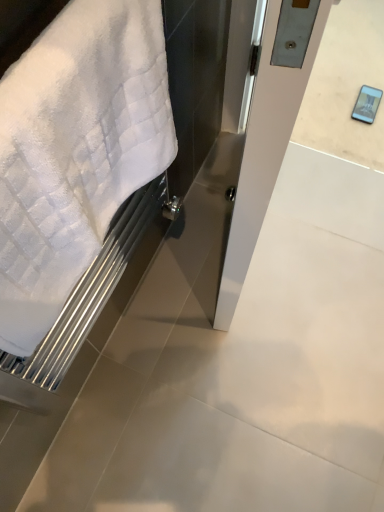
Question: Is satin silver door at center wider or thinner than white soft towel at left?

Choices:
 (A) wide
 (B) thin

Answer: (A)

Question: From a real-world perspective, is satin silver door at center positioned above or below white soft towel at left?

Choices:
 (A) above
 (B) below

Answer: (B)

Question: From the image's perspective, is satin silver door at center located above or below white soft towel at left?

Choices:
 (A) above
 (B) below

Answer: (A)

Question: From the image's perspective, is white soft towel at left located above or below satin silver door at center?

Choices:
 (A) below
 (B) above

Answer: (A)

Question: Considering the positions of white soft towel at left and satin silver door at center in the image, is white soft towel at left taller or shorter than satin silver door at center?

Choices:
 (A) short
 (B) tall

Answer: (A)

Question: Is white soft towel at left bigger or smaller than satin silver door at center?

Choices:
 (A) small
 (B) big

Answer: (A)

Question: Does point (122, 140) appear closer or farther from the camera than point (274, 82)?

Choices:
 (A) closer
 (B) farther

Answer: (B)